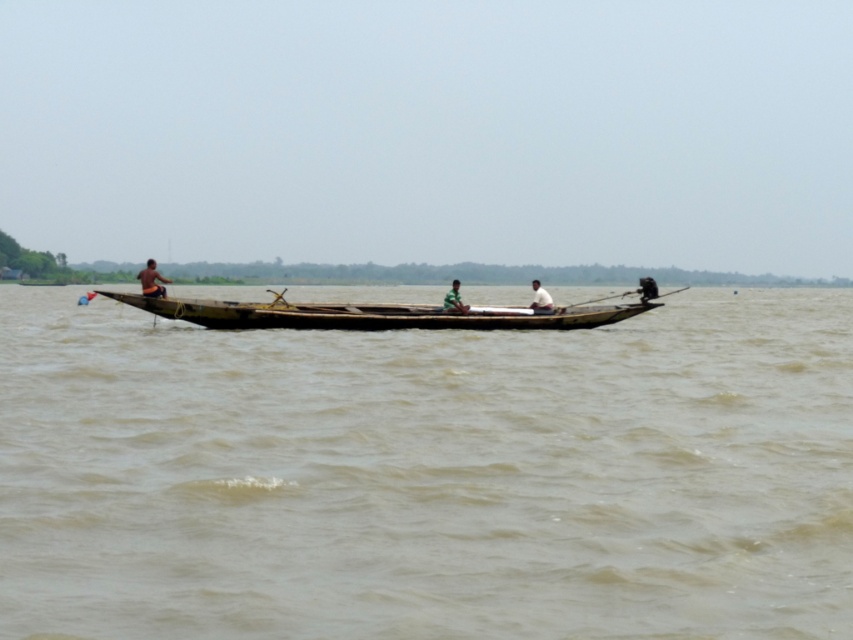
From the picture: Who is positioned more to the left, brown wooden boat at center or green fabric person at center?

From the viewer's perspective, brown wooden boat at center appears more on the left side.

Consider the image. Can you confirm if brown wooden boat at center is thinner than green fabric person at center?

In fact, brown wooden boat at center might be wider than green fabric person at center.

Between point (136, 326) and point (457, 282), which one is positioned in front?

Positioned in front is point (457, 282).

At what (x,y) coordinates should I click in order to perform the action: click on brown wooden boat at center. Please return your answer as a coordinate pair (x, y). Looking at the image, I should click on (428, 474).

Is brown wooden boat at left above white fabric shirt at center?

Indeed, brown wooden boat at left is positioned over white fabric shirt at center.

The width and height of the screenshot is (853, 640). Describe the element at coordinates (152, 280) in the screenshot. I see `brown wooden boat at left` at that location.

Is point (164, 278) behind point (544, 310)?

That is False.

Find the location of a particular element. brown wooden boat at left is located at coordinates (152, 280).

Is rusty wood boat at center positioned in front of white fabric shirt at center?

That is True.

Between rusty wood boat at center and white fabric shirt at center, which one has more height?

rusty wood boat at center

Which is in front, point (491, 317) or point (546, 300)?

Point (491, 317) is in front.

Where is `rusty wood boat at center`? rusty wood boat at center is located at coordinates (368, 314).